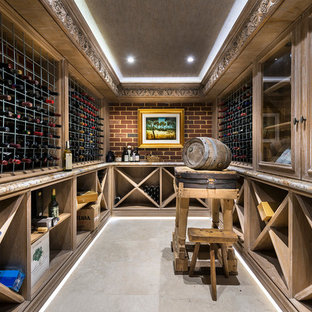
Locate an element on the screen. gold frame is located at coordinates click(149, 110).